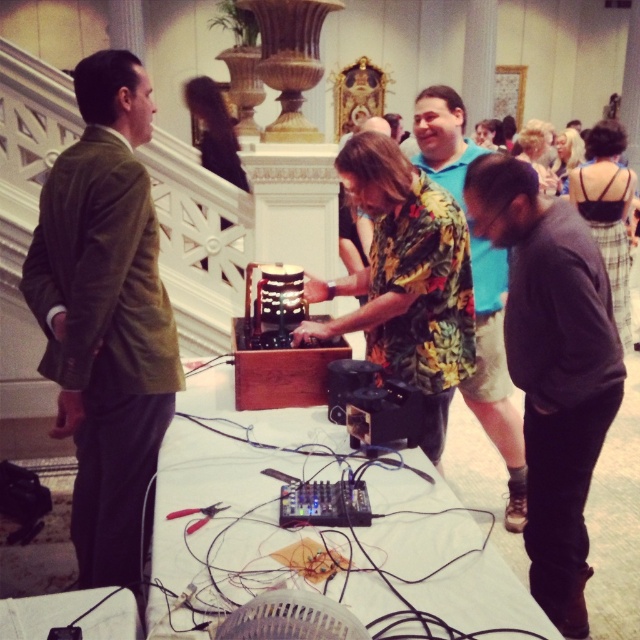
You are at the event and want to place a large centerpiece on the black plastic table at center. Considering the size of the floral shirt at center, will the table be able to accommodate the centerpiece?

The black plastic table at center is smaller than the floral shirt at center. Since the table is smaller, it might not have enough space to accommodate a large centerpiece unless the shirt is moved or the centerpiece is scaled down.

You are at a social event and need to decide which clothing item to approach first. You see the dark gray sweater at lower right and the floral print shirt at center. Which one is closer to you?

The dark gray sweater at lower right is closer to you because it is positioned lower than the floral print shirt at center, which is in the center of the image.